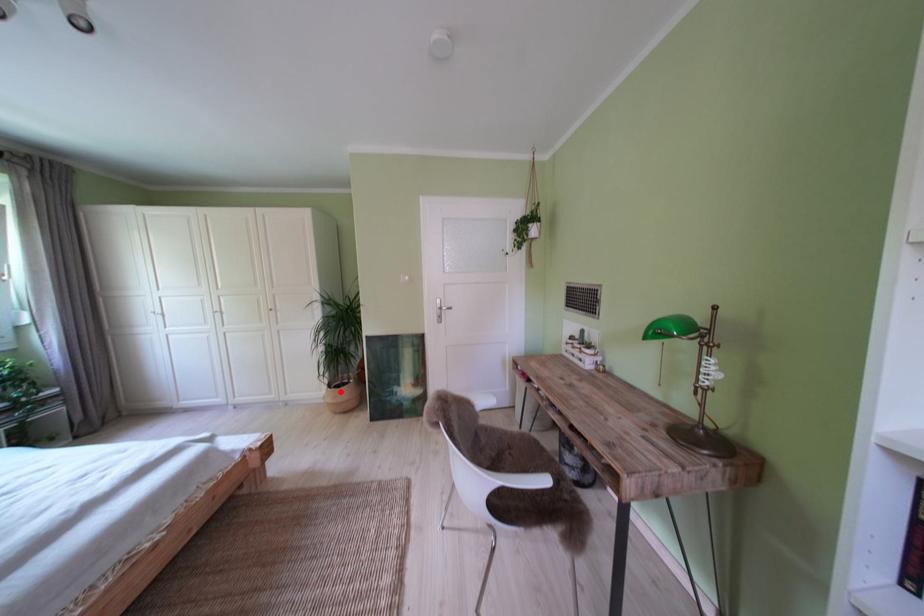
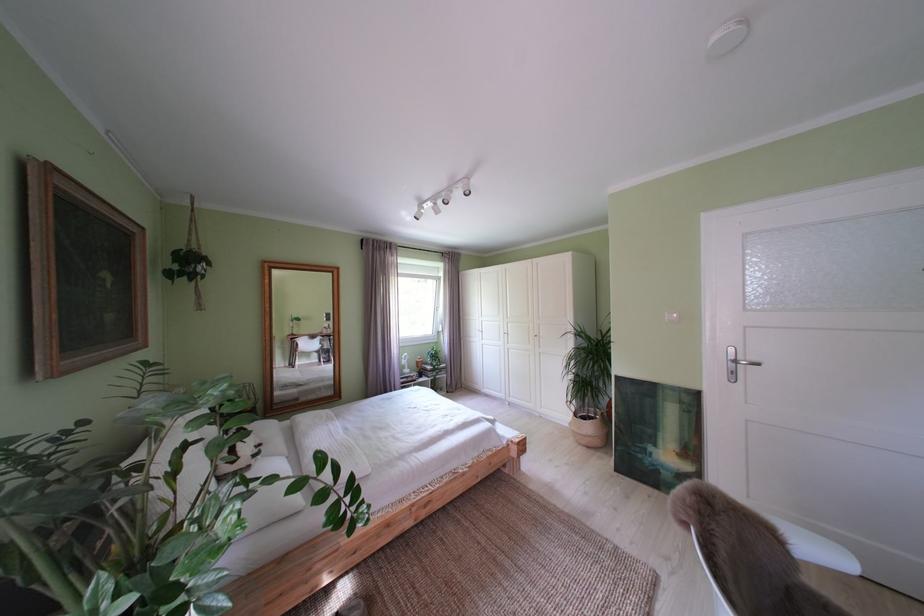
Question: A red point is marked in image1. In image2, is the corresponding 3D point closer to the camera or farther? Reply with the corresponding letter.

Choices:
 (A) The corresponding 3D point is closer.
 (B) The corresponding 3D point is farther.

Answer: (B)